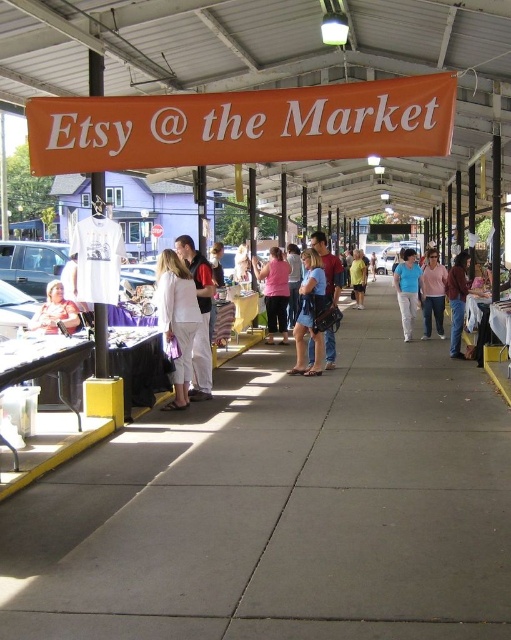
Does blue denim shorts at center have a greater width compared to blue cotton shirt at center?

No, blue denim shorts at center is not wider than blue cotton shirt at center.

Image resolution: width=511 pixels, height=640 pixels. What do you see at coordinates (310, 314) in the screenshot? I see `blue denim shorts at center` at bounding box center [310, 314].

I want to click on blue denim shorts at center, so click(310, 314).

Who is shorter, white matte pants at center or denim jacket at center?

Standing shorter between the two is white matte pants at center.

Does point (166, 337) come farther from viewer compared to point (463, 291)?

No.

The image size is (511, 640). Find the location of `white matte pants at center`. white matte pants at center is located at coordinates (176, 320).

Does pink cotton shirt at center appear over yellow cotton shirt at center?

Incorrect, pink cotton shirt at center is not positioned above yellow cotton shirt at center.

Who is higher up, pink cotton shirt at center or yellow cotton shirt at center?

yellow cotton shirt at center is higher up.

Which is in front, point (437, 291) or point (362, 278)?

Positioned in front is point (437, 291).

Where is `pink cotton shirt at center`? The image size is (511, 640). pink cotton shirt at center is located at coordinates (432, 292).